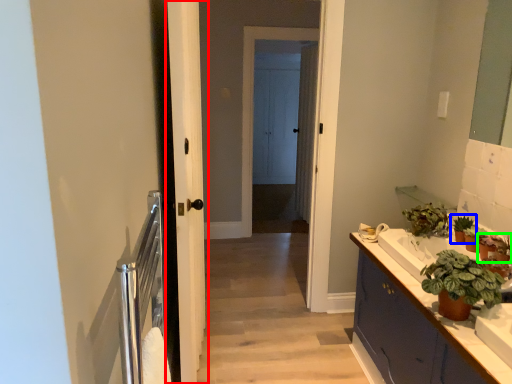
Question: Which is farther away from door (highlighted by a red box)? houseplant (highlighted by a blue box) or houseplant (highlighted by a green box)?

Choices:
 (A) houseplant
 (B) houseplant

Answer: (B)